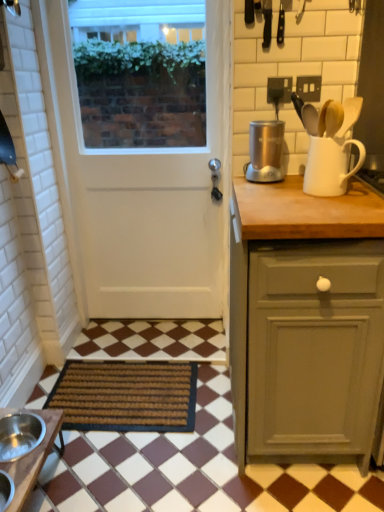
Where is `free location to the left of matte gray cabinet at right`? The width and height of the screenshot is (384, 512). free location to the left of matte gray cabinet at right is located at coordinates (173, 455).